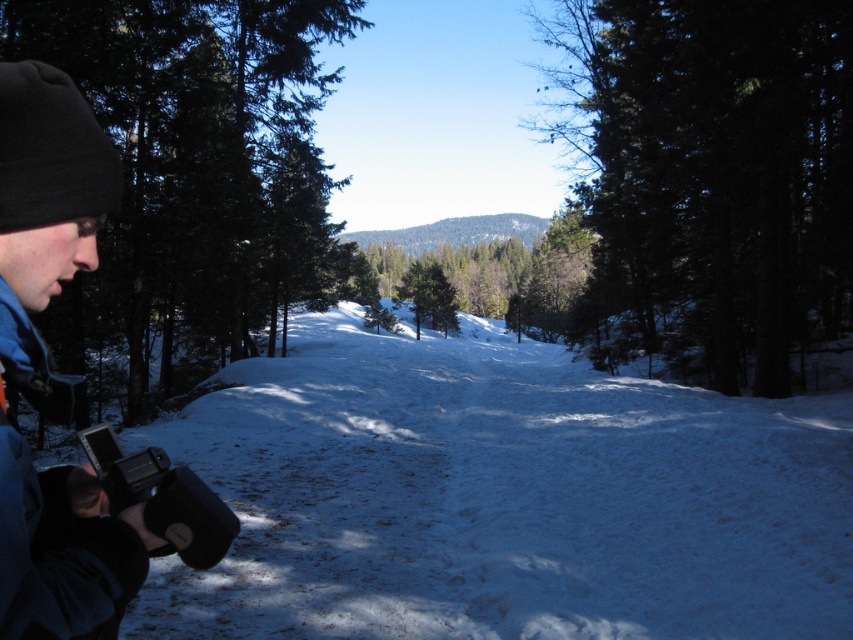
You are a photographer standing in the winter forest scene. You want to capture a shot of the green matte tree at left and the white powdery snow at center. Based on their positions, which object is closer to the camera?

The white powdery snow at center is closer to the camera because it is positioned below the green matte tree at left, indicating it is in a lower layer of the image.

You are a photographer trying to capture the green matte tree at center and the white powdery snow at center in your shot. Based on the scene, which object is located to the left of the other?

The white powdery snow at center is positioned on the left side of green matte tree at center.

You are a photographer trying to capture the white powdery snow at center and the green matte tree at center in a single shot. Based on their positions, can you tell which one is closer to the camera?

The white powdery snow at center is in front of the green matte tree at center, so the white powdery snow at center is closer to the camera.